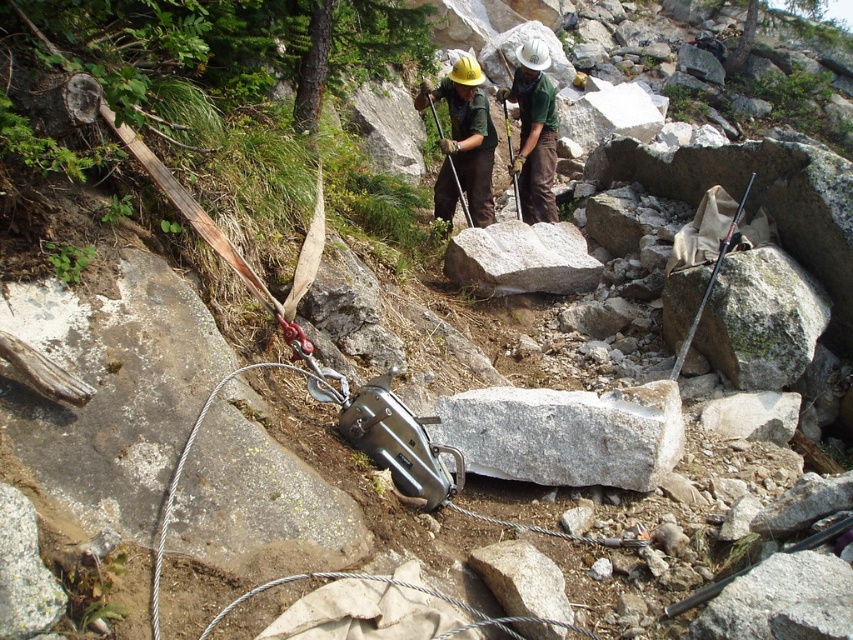
You are a construction worker needing to move the matte black tool at center to the left. Which direction should you move the white smooth rock at center to clear the path?

The white smooth rock at center is on the right side of the matte black tool at center. To move the tool to the left, you should move the white smooth rock at center to the right to clear the path.